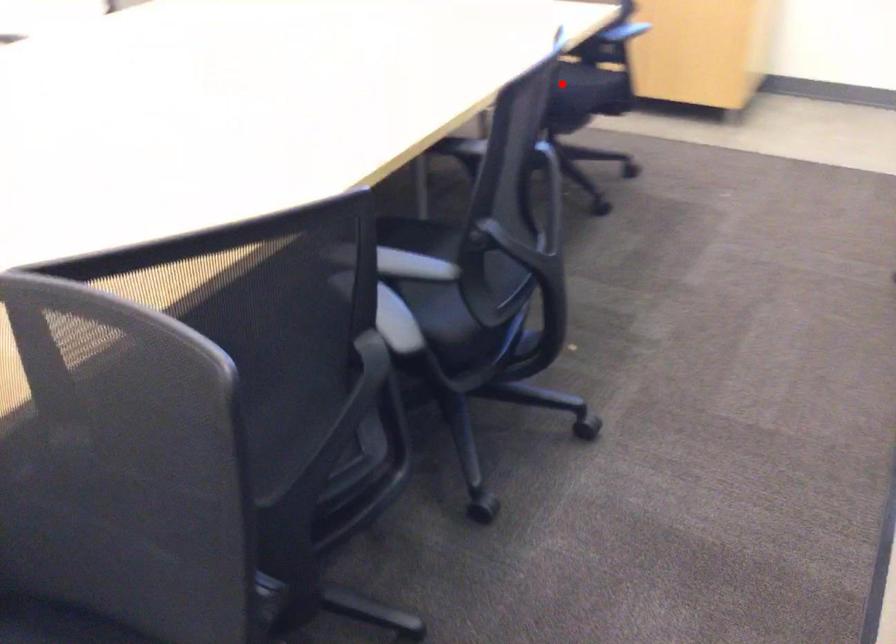
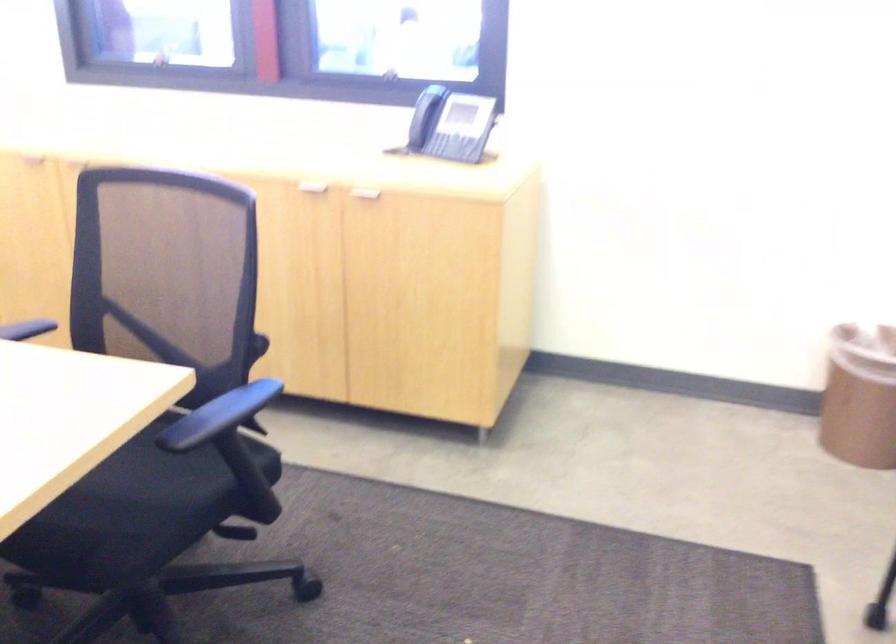
Question: I am providing you with two images of the same scene from different viewpoints. In image1, a red point is highlighted. Considering the same 3D point in image2, which of the following is correct?

Choices:
 (A) It is closer
 (B) It is farther

Answer: (A)